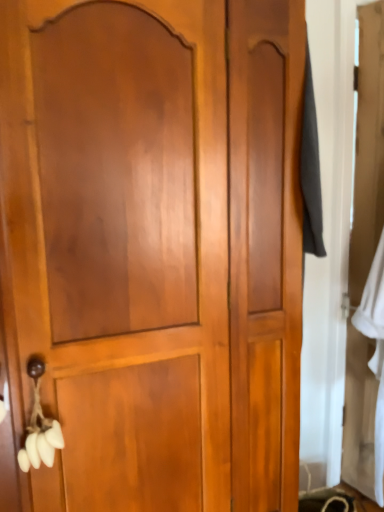
What do you see at coordinates (364, 248) in the screenshot? I see `white fabric screen door at right` at bounding box center [364, 248].

You are a GUI agent. You are given a task and a screenshot of the screen. Output one action in this format:
    pyautogui.click(x=<x>, y=<y>)
    Task: Click on the white fabric screen door at right
    The image size is (384, 512).
    Given the screenshot: What is the action you would take?
    pyautogui.click(x=364, y=248)

Identify the location of white fabric screen door at right. The width and height of the screenshot is (384, 512). (364, 248).